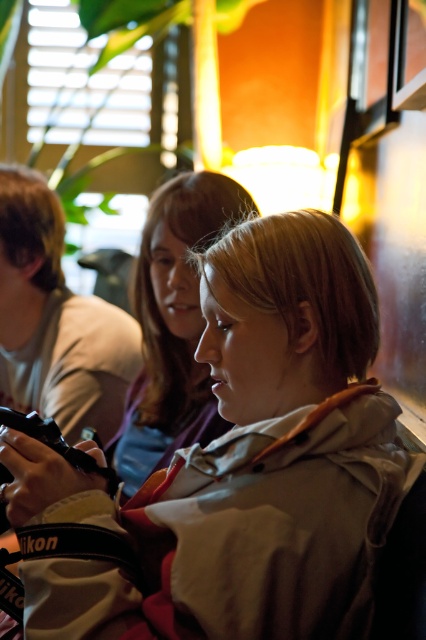
Question: Which point is farther to the camera?

Choices:
 (A) (224, 516)
 (B) (144, 310)

Answer: (B)

Question: Which object is farther from the camera taking this photo?

Choices:
 (A) matte gray jacket at center
 (B) matte beige hoodie at center

Answer: (B)

Question: Considering the relative positions of matte gray jacket at center and matte beige hoodie at center in the image provided, where is matte gray jacket at center located with respect to matte beige hoodie at center?

Choices:
 (A) below
 (B) above

Answer: (A)

Question: Is matte gray jacket at center closer to camera compared to matte beige hoodie at center?

Choices:
 (A) no
 (B) yes

Answer: (B)

Question: Which object is closer to the camera taking this photo?

Choices:
 (A) matte beige hoodie at center
 (B) matte gray jacket at center

Answer: (B)

Question: Does matte gray jacket at center come behind matte beige hoodie at center?

Choices:
 (A) yes
 (B) no

Answer: (B)